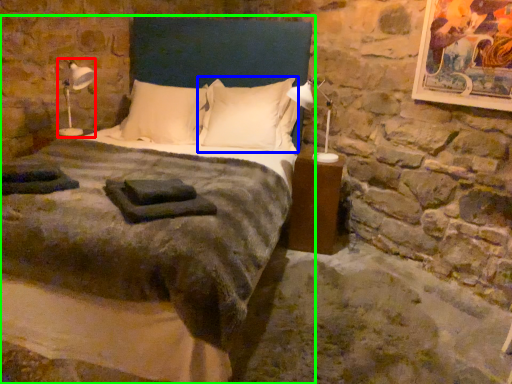
Question: Which is farther away from bedside lamp (highlighted by a red box)? pillow (highlighted by a blue box) or bed (highlighted by a green box)?

Choices:
 (A) pillow
 (B) bed

Answer: (B)